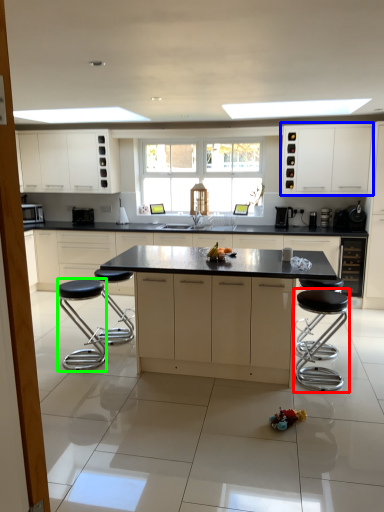
Question: Which object is the farthest from bar stool (highlighted by a red box)? Choose among these: cabinetry (highlighted by a blue box) or bar stool (highlighted by a green box).

Choices:
 (A) cabinetry
 (B) bar stool

Answer: (A)